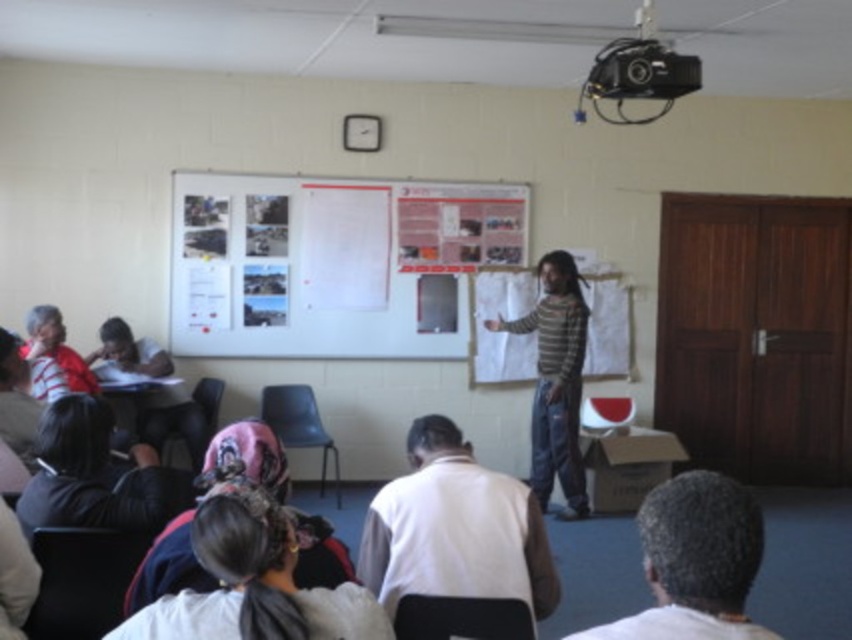
Question: Is gray hair at lower right below velvet pink chair at lower left?

Choices:
 (A) no
 (B) yes

Answer: (A)

Question: Estimate the real-world distances between objects in this image. Which object is closer to the matte red shirt at left?

Choices:
 (A) striped sweater at center
 (B) dark brown hair at lower left
 (C) gray hair at lower right

Answer: (B)

Question: Based on their relative distances, which object is nearer to the dark brown hair at lower left?

Choices:
 (A) matte black chair at lower left
 (B) striped sweater at center
 (C) matte black headscarf at left
 (D) white matte shirt at lower center

Answer: (A)

Question: Which object is positioned closest to the whiteboard at upper center?

Choices:
 (A) matte plastic chair at center
 (B) gray hair at lower right
 (C) dark brown hair at lower left
 (D) white fabric headscarf at lower center

Answer: (A)

Question: Does white fabric headscarf at lower center have a lesser width compared to black fabric chair at lower center?

Choices:
 (A) no
 (B) yes

Answer: (A)

Question: Does dark brown hair at lower left have a smaller size compared to matte plastic chair at center?

Choices:
 (A) yes
 (B) no

Answer: (B)